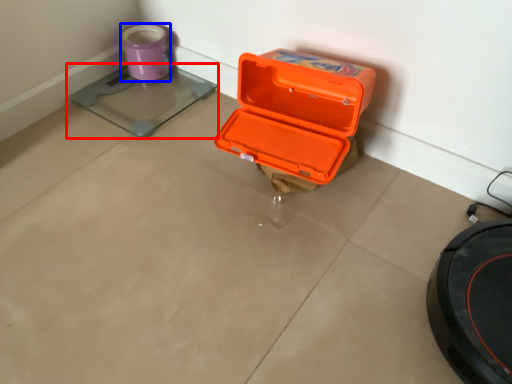
Question: Which point is further to the camera, weight scale (highlighted by a red box) or appliance (highlighted by a blue box)?

Choices:
 (A) weight scale
 (B) appliance

Answer: (B)